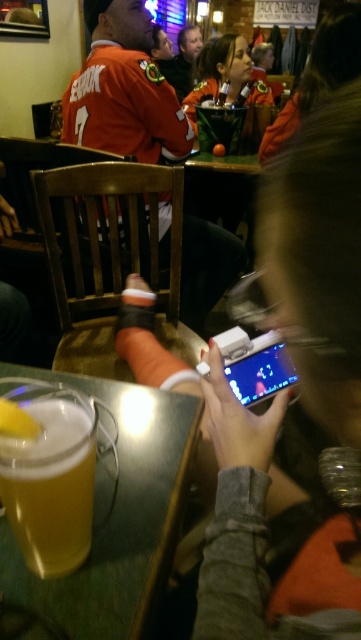
Question: Is orange jersey at upper left below golden frothy beer at lower left?

Choices:
 (A) yes
 (B) no

Answer: (B)

Question: Which of the following is the farthest from the observer?

Choices:
 (A) golden frothy beer at lower left
 (B) translucent glass mug at lower left
 (C) orange jersey at upper left

Answer: (C)

Question: In this image, where is translucent glass mug at lower left located relative to matte black jacket at center?

Choices:
 (A) below
 (B) above

Answer: (A)

Question: Which of these objects is positioned closest to the orange jersey at upper left?

Choices:
 (A) matte black jacket at center
 (B) golden frothy beer at lower left
 (C) translucent glass mug at lower left

Answer: (A)

Question: Which point appears farthest from the camera in this image?

Choices:
 (A) (164, 227)
 (B) (241, 83)

Answer: (B)

Question: Can you confirm if orange jersey at upper left is positioned below matte black jacket at center?

Choices:
 (A) no
 (B) yes

Answer: (B)